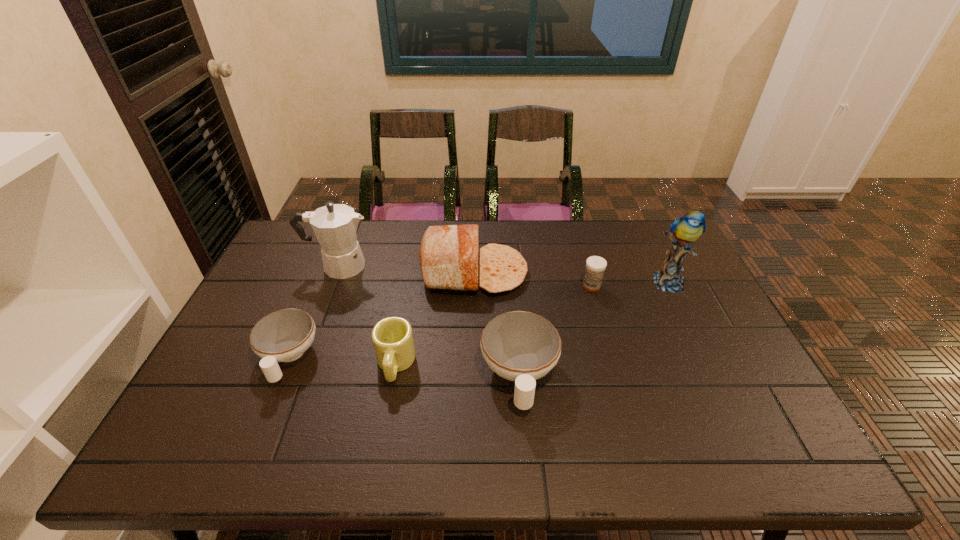
This screenshot has width=960, height=540. Identify the location of blank region between the coffeepot and the right chinaware. (429, 320).

Identify the location of unoccupied position between the bread and the parrot. This screenshot has width=960, height=540. (571, 277).

Where is `the fourth closest object to the left chinaware`? This screenshot has height=540, width=960. the fourth closest object to the left chinaware is located at coordinates (520, 346).

Find the location of a particular element. The image size is (960, 540). the closest object to the taller chinaware is located at coordinates (448, 256).

What are the coordinates of `blank area in the image that satisfies the following two spatial constraints: 1. at the sliced end of the fifth shortest object; 2. on the side with the handle of the left chinaware` in the screenshot? It's located at (473, 357).